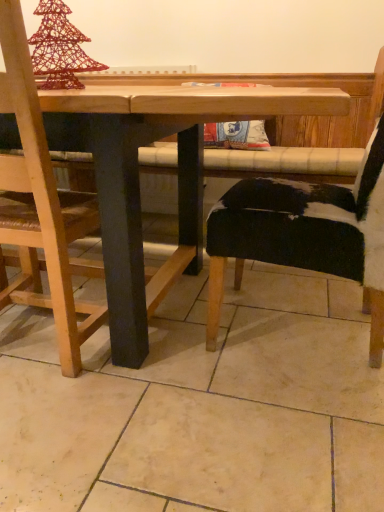
Find the location of a particular element. free space in front of wooden chair at left, which is the first chair in left-to-right order is located at coordinates (67, 423).